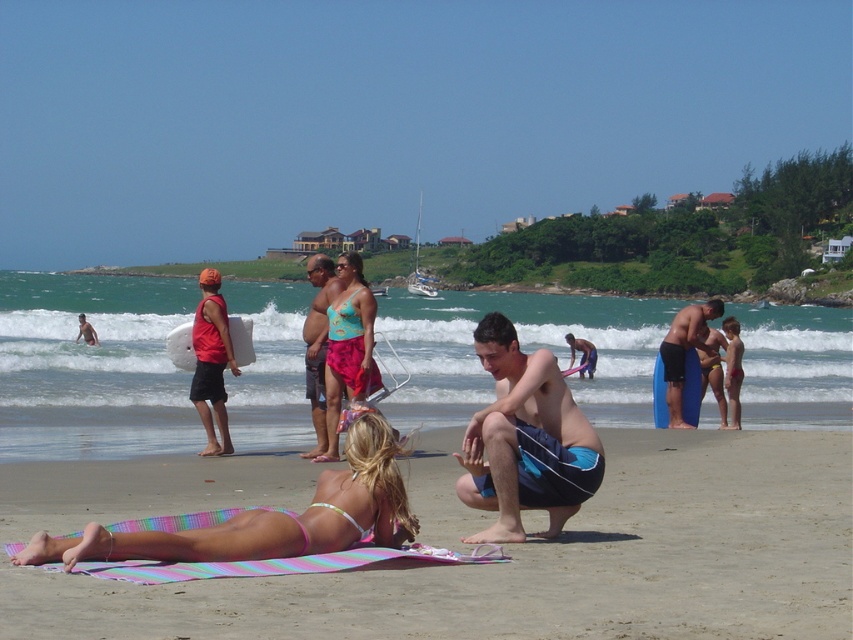
You are a photographer positioned at the center of the beach scene. You want to take a photo that includes both the matte red tank top at center and the matte teal bikini top at center. However, you notice that one of them might be blocking the other. Which object is blocking the other, and which one is visible in front?

The matte red tank top at center is visible in front, while the matte teal bikini top at center is behind it, so the matte red tank top at center is blocking the matte teal bikini top at center.

You are a photographer positioned at the center of the beach scene. You want to capture a photo that includes both the matte teal bikini top at center and the matte blue surfboard at center. Based on their positions, which object should you adjust your camera to focus on first to ensure both are in frame?

The matte teal bikini top at center is to the left of the matte blue surfboard at center. To include both in the frame, focus on the matte teal bikini top at center first since it is positioned further left, then adjust the camera to include the matte blue surfboard at center on the right.